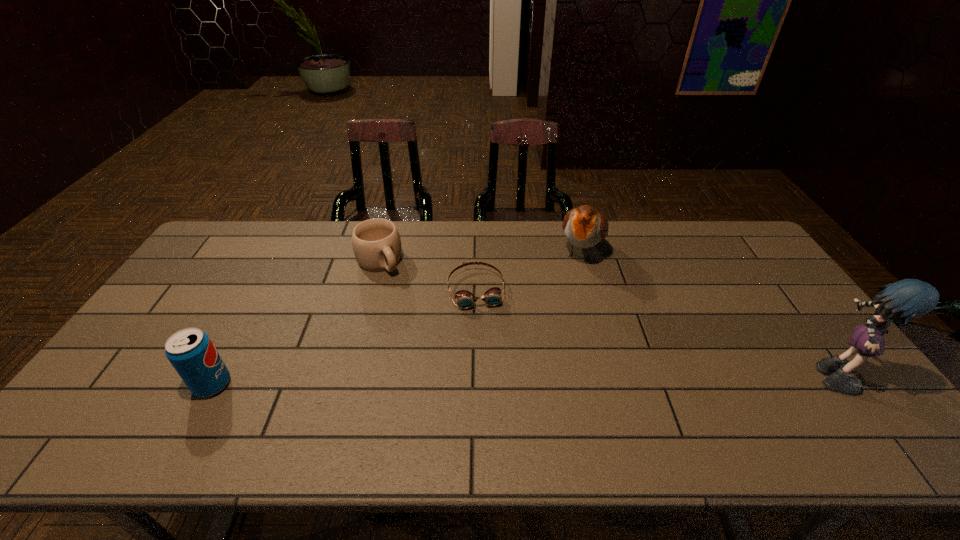
This screenshot has height=540, width=960. Find the location of `free space on the desktop that is between the third tallest object and the rag doll and is positioned on the side of the fourth object from right to left with the handle`. free space on the desktop that is between the third tallest object and the rag doll and is positioned on the side of the fourth object from right to left with the handle is located at coordinates (473, 379).

This screenshot has height=540, width=960. What are the coordinates of `free space on the desktop that is between the third tallest object and the rightmost object and is positioned at the face of the bird` in the screenshot? It's located at (534, 377).

Where is `free space on the desktop that is between the leftmost object and the rightmost object and is positioned through the lenses of the goggles`? This screenshot has width=960, height=540. free space on the desktop that is between the leftmost object and the rightmost object and is positioned through the lenses of the goggles is located at coordinates (492, 379).